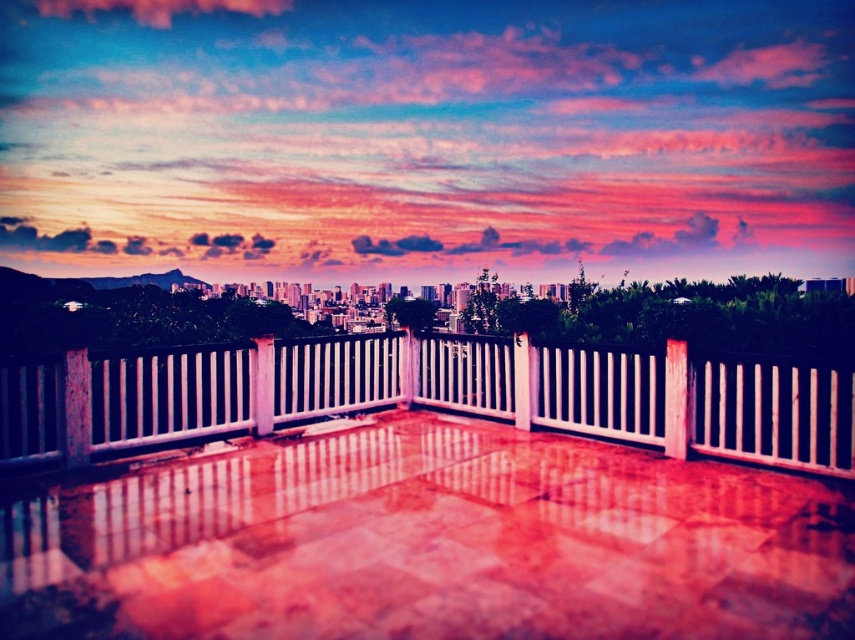
Question: Is smooth concrete deck at center bigger than white glossy fence at center?

Choices:
 (A) no
 (B) yes

Answer: (B)

Question: Is smooth concrete deck at center thinner than white glossy fence at center?

Choices:
 (A) yes
 (B) no

Answer: (B)

Question: Is smooth concrete deck at center to the right of white glossy fence at center from the viewer's perspective?

Choices:
 (A) yes
 (B) no

Answer: (A)

Question: Which of the following is the farthest from the observer?

Choices:
 (A) (621, 413)
 (B) (355, 544)

Answer: (A)